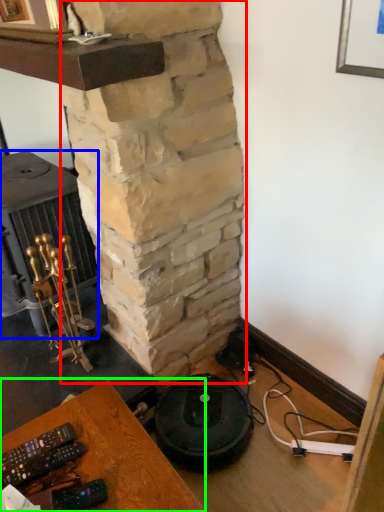
Question: Which is nearer to the pillar (highlighted by a red box)? stove (highlighted by a blue box) or furniture (highlighted by a green box).

Choices:
 (A) stove
 (B) furniture

Answer: (A)